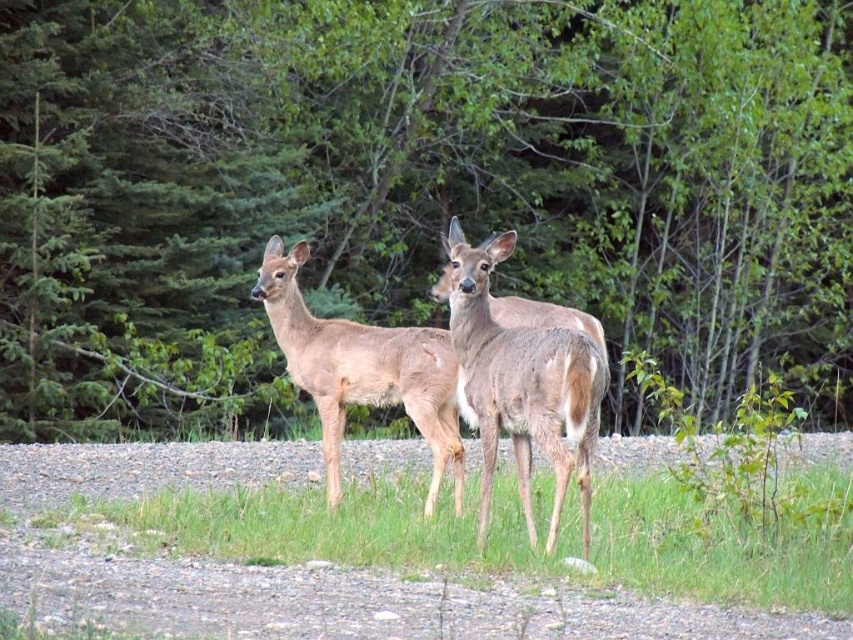
Between point (386, 250) and point (422, 433), which one is positioned behind?

Positioned behind is point (386, 250).

I want to click on green leafy forest at center, so click(415, 189).

You are a GUI agent. You are given a task and a screenshot of the screen. Output one action in this format:
    pyautogui.click(x=<x>, y=<y>)
    Task: Click on the green leafy forest at center
    The height and width of the screenshot is (640, 853).
    Given the screenshot: What is the action you would take?
    pyautogui.click(x=415, y=189)

Is point (595, 348) closer to camera compared to point (393, 401)?

That is True.

Is brown matte fur at center positioned behind brown fur deer at center?

No, it is not.

Describe the element at coordinates (521, 385) in the screenshot. The width and height of the screenshot is (853, 640). I see `brown matte fur at center` at that location.

At what (x,y) coordinates should I click in order to perform the action: click on brown matte fur at center. Please return your answer as a coordinate pair (x, y). Looking at the image, I should click on (521, 385).

Who is more forward, (163, 64) or (515, 413)?

Point (515, 413) is more forward.

Find the location of `green leafy forest at center`. green leafy forest at center is located at coordinates (415, 189).

Find the location of `green leafy forest at center`. green leafy forest at center is located at coordinates pos(415,189).